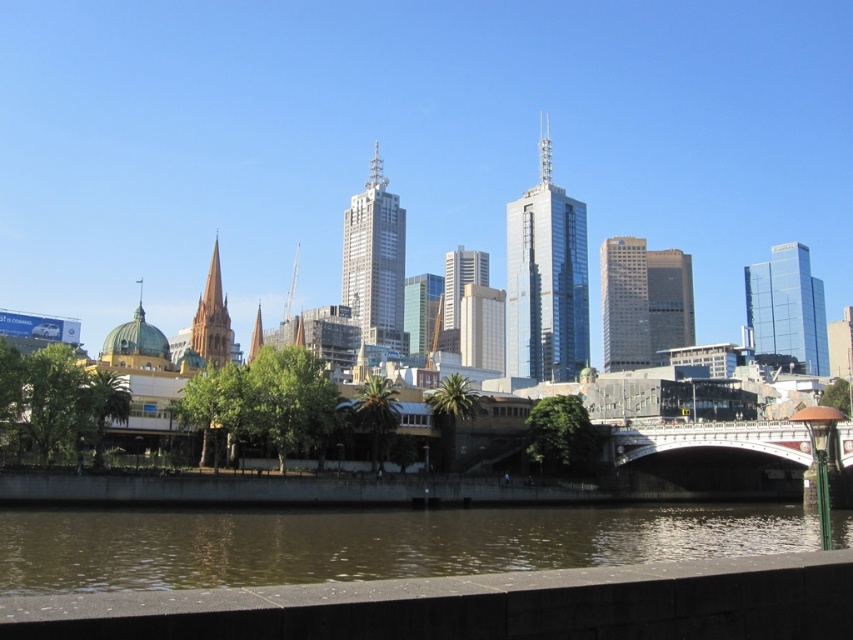
Question: Can you confirm if shiny glass skyscraper at center is bigger than matte stone spire at center-left?

Choices:
 (A) yes
 (B) no

Answer: (A)

Question: Which of the following is the closest to the observer?

Choices:
 (A) (567, 230)
 (B) (376, 224)
 (C) (213, 349)
 (D) (792, 346)

Answer: (C)

Question: Which point is closer to the camera taking this photo?

Choices:
 (A) (218, 305)
 (B) (199, 580)
 (C) (392, 202)
 (D) (762, 426)

Answer: (B)

Question: Considering the relative positions of matte glass skyscraper at center and matte stone spire at center-left in the image provided, where is matte glass skyscraper at center located with respect to matte stone spire at center-left?

Choices:
 (A) below
 (B) above

Answer: (A)

Question: Among these points, which one is nearest to the camera?

Choices:
 (A) (726, 483)
 (B) (363, 212)

Answer: (A)

Question: Is shiny glass skyscraper at center thinner than transparent glass skyscraper at upper right?

Choices:
 (A) no
 (B) yes

Answer: (B)